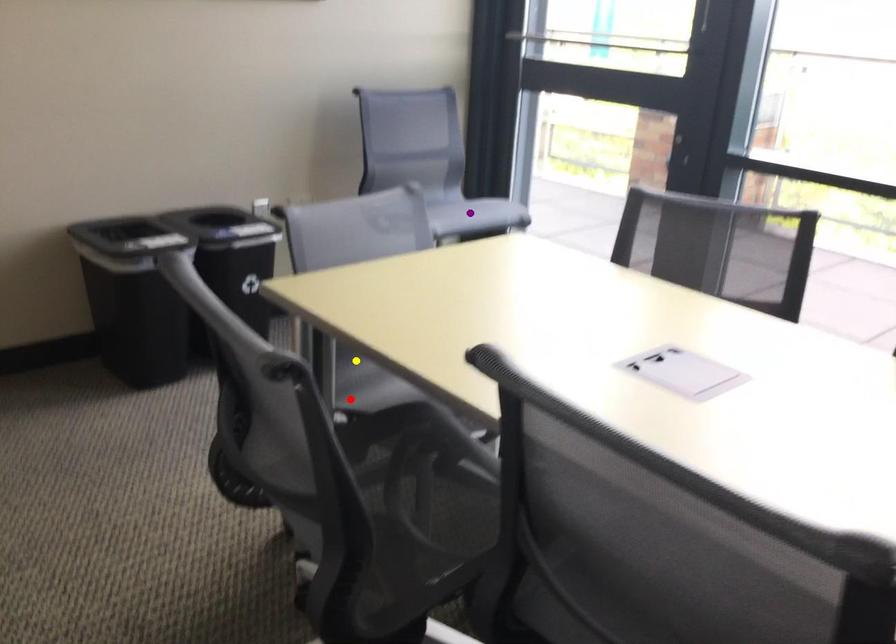
Order these from nearest to farthest:
A) purple point
B) yellow point
C) red point

red point, yellow point, purple point